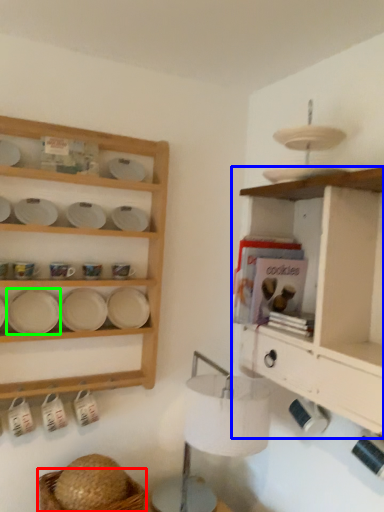
Question: Estimate the real-world distances between objects in this image. Which object is closer to basket (highlighted by a red box), shelf (highlighted by a blue box) or platter (highlighted by a green box)?

Choices:
 (A) shelf
 (B) platter

Answer: (B)